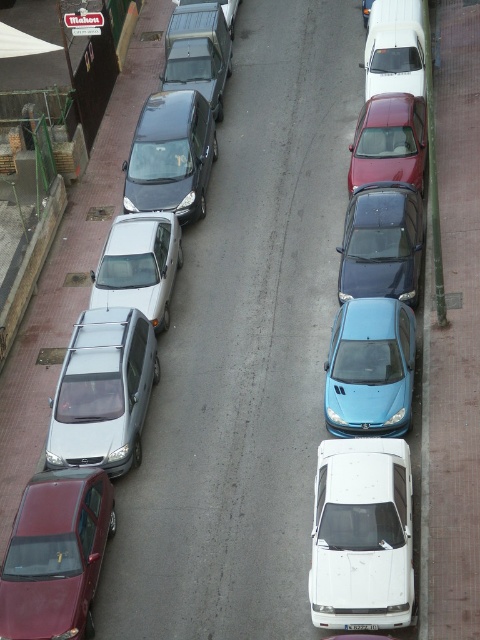
You are a delivery driver needing to park your vehicle between the matte blue car at center and the white glossy van at upper right. Based on their positions, can you safely park your car there without blocking the road?

The matte blue car at center is located below the white glossy van at upper right. Since the van is positioned higher up, there might be enough space between them for parking, but you should check the distance to ensure it doesn